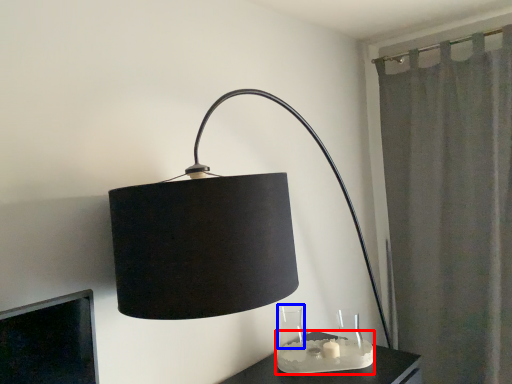
Question: Among these objects, which one is farthest to the camera, candle holder (highlighted by a red box) or glass vase (highlighted by a blue box)?

Choices:
 (A) candle holder
 (B) glass vase

Answer: (B)